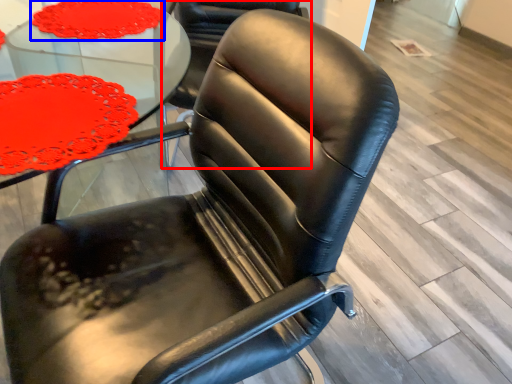
Question: Which of the following is the closest to the observer, chair (highlighted by a red box) or tablecloth (highlighted by a blue box)?

Choices:
 (A) chair
 (B) tablecloth

Answer: (B)